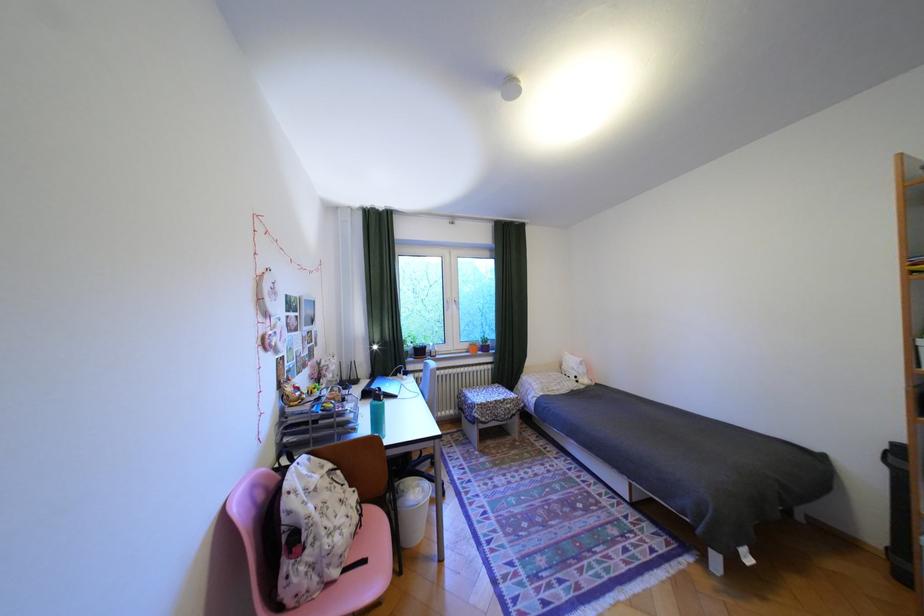
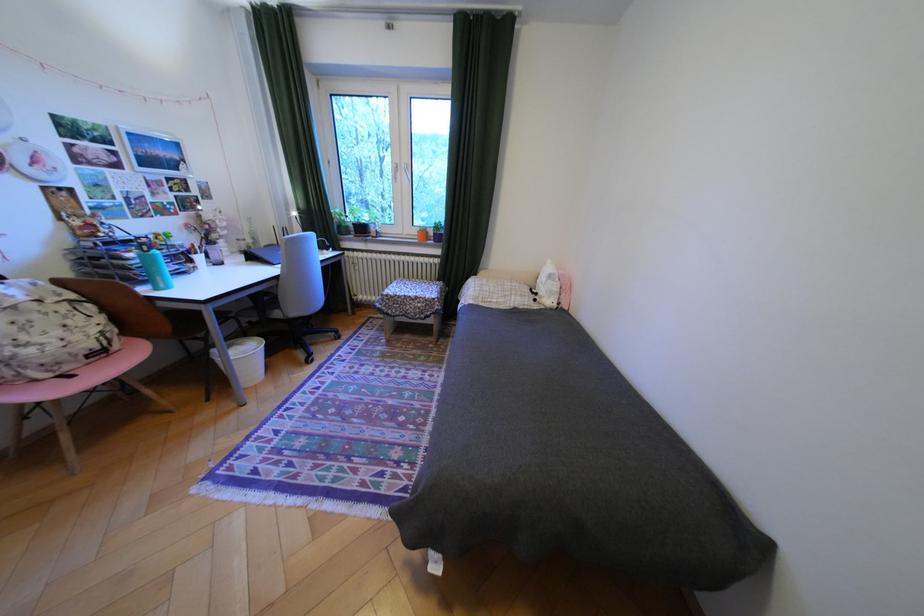
In the second image, find the point that corresponds to point (588, 378) in the first image.

(548, 294)